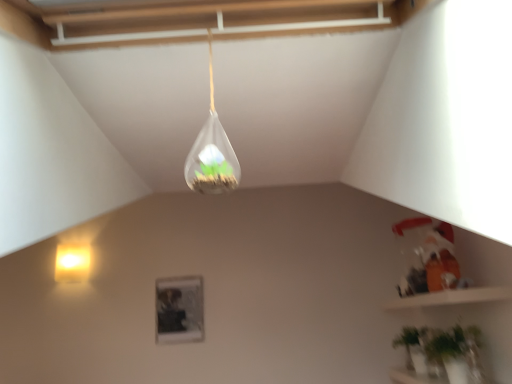
Measure the distance between transparent glass terrarium at upper center, the 2th lamp in the bottom-to-top sequence, and camera.

The depth of transparent glass terrarium at upper center, the 2th lamp in the bottom-to-top sequence, is 29.05 inches.

At what (x,y) coordinates should I click in order to perform the action: click on matte yellow wall sconce at left, acting as the 2th lamp starting from the front. Please return your answer as a coordinate pair (x, y). Image resolution: width=512 pixels, height=384 pixels. Looking at the image, I should click on coord(73,262).

Locate an element on the screen. transparent glass terrarium at upper center, the first lamp from the front is located at coordinates (212, 153).

Looking at this image, are matte yellow wall sconce at left, which is the second lamp in top-to-bottom order, and green matte plant at lower right beside each other?

They are not placed beside each other.

Could you tell me if matte yellow wall sconce at left, the 2th lamp in the right-to-left sequence, is facing green matte plant at lower right?

No, matte yellow wall sconce at left, the 2th lamp in the right-to-left sequence, is not oriented towards green matte plant at lower right.

Considering the positions of points (90, 257) and (471, 355), is point (90, 257) closer to camera compared to point (471, 355)?

No, it is not.

From a real-world perspective, who is located lower, matte yellow wall sconce at left, which is the 1th lamp in bottom-to-top order, or green matte plant at lower right?

green matte plant at lower right, from a real-world perspective.

Could you tell me if green matte plant at lower right is turned towards matte yellow wall sconce at left, which is the 1th lamp in bottom-to-top order?

Yes, green matte plant at lower right is turned towards matte yellow wall sconce at left, which is the 1th lamp in bottom-to-top order.

Are green matte plant at lower right and matte yellow wall sconce at left, acting as the 2th lamp starting from the front, far apart?

Yes, green matte plant at lower right and matte yellow wall sconce at left, acting as the 2th lamp starting from the front, are quite far apart.

How many degrees apart are the facing directions of green matte plant at lower right and matte yellow wall sconce at left, which is the 1th lamp in bottom-to-top order?

The facing directions of green matte plant at lower right and matte yellow wall sconce at left, which is the 1th lamp in bottom-to-top order, are 89.4 degrees apart.

From the image's perspective, which one is positioned lower, green matte plant at lower right or transparent glass terrarium at upper center, the first lamp from the front?

From the image's view, green matte plant at lower right is below.

Is point (437, 382) positioned in front of point (229, 181)?

No, (437, 382) is further to viewer.

Is green matte plant at lower right taller than transparent glass terrarium at upper center, the first lamp from the front?

No.

Considering the relative sizes of green matte plant at lower right and transparent glass terrarium at upper center, the 1th lamp from the right, in the image provided, is green matte plant at lower right thinner than transparent glass terrarium at upper center, the 1th lamp from the right,?

No.

In the scene shown: From the image's perspective, which one is positioned higher, transparent glass terrarium at upper center, the 2th lamp in the bottom-to-top sequence, or green matte plant at lower right?

transparent glass terrarium at upper center, the 2th lamp in the bottom-to-top sequence.

From the picture: In the image, is transparent glass terrarium at upper center, the first lamp from the front, on the left side or the right side of green matte plant at lower right?

transparent glass terrarium at upper center, the first lamp from the front, is to the left of green matte plant at lower right.

Is transparent glass terrarium at upper center, the 2th lamp when ordered from left to right, far from green matte plant at lower right?

That's right, there is a large distance between transparent glass terrarium at upper center, the 2th lamp when ordered from left to right, and green matte plant at lower right.

From the image's perspective, is matte yellow wall sconce at left, the 2th lamp in the right-to-left sequence, above or below transparent glass terrarium at upper center, the 1th lamp from the right?

From the image's perspective, matte yellow wall sconce at left, the 2th lamp in the right-to-left sequence, appears below transparent glass terrarium at upper center, the 1th lamp from the right.

Which is in front, matte yellow wall sconce at left, acting as the 2th lamp starting from the front, or transparent glass terrarium at upper center, the 1th lamp from the right?

transparent glass terrarium at upper center, the 1th lamp from the right, is closer to the camera.

Is matte yellow wall sconce at left, which ranks as the first lamp in left-to-right order, aimed at transparent glass terrarium at upper center, the first lamp from the front?

No.

Can you confirm if matte yellow wall sconce at left, the 2th lamp in the right-to-left sequence, is thinner than transparent glass terrarium at upper center, the first lamp from the front?

Incorrect, the width of matte yellow wall sconce at left, the 2th lamp in the right-to-left sequence, is not less than that of transparent glass terrarium at upper center, the first lamp from the front.

Considering the positions of objects transparent glass terrarium at upper center, which is counted as the 2th lamp, starting from the back, and matte yellow wall sconce at left, which is the 1th lamp in bottom-to-top order, in the image provided, who is more to the right, transparent glass terrarium at upper center, which is counted as the 2th lamp, starting from the back, or matte yellow wall sconce at left, which is the 1th lamp in bottom-to-top order,?

From the viewer's perspective, transparent glass terrarium at upper center, which is counted as the 2th lamp, starting from the back, appears more on the right side.

From the image's perspective, is transparent glass terrarium at upper center, which is counted as the 2th lamp, starting from the back, over matte yellow wall sconce at left, acting as the 2th lamp starting from the front?

Yes.

Consider the image. From a real-world perspective, is transparent glass terrarium at upper center, which is counted as the 2th lamp, starting from the back, above or below matte yellow wall sconce at left, the 2th lamp in the right-to-left sequence?

Clearly, from a real-world perspective, transparent glass terrarium at upper center, which is counted as the 2th lamp, starting from the back, is below matte yellow wall sconce at left, the 2th lamp in the right-to-left sequence.

Find the location of `houseplant that appears on the right of matte yellow wall sconce at left, which is the second lamp in top-to-bottom order`. houseplant that appears on the right of matte yellow wall sconce at left, which is the second lamp in top-to-bottom order is located at coordinates (442, 356).

Where is `lamp behind the green matte plant at lower right`? lamp behind the green matte plant at lower right is located at coordinates (73, 262).

Estimate the real-world distances between objects in this image. Which object is closer to matte yellow wall sconce at left, acting as the 2th lamp starting from the front, green matte plant at lower right or transparent glass terrarium at upper center, which is counted as the 2th lamp, starting from the back?

Among the two, green matte plant at lower right is located nearer to matte yellow wall sconce at left, acting as the 2th lamp starting from the front.

Looking at the image, which one is located further to transparent glass terrarium at upper center, the 1th lamp from the right, green matte plant at lower right or matte yellow wall sconce at left, which is the second lamp in top-to-bottom order?

matte yellow wall sconce at left, which is the second lamp in top-to-bottom order, is further to transparent glass terrarium at upper center, the 1th lamp from the right.

Based on their spatial positions, is transparent glass terrarium at upper center, the 2th lamp in the bottom-to-top sequence, or matte yellow wall sconce at left, the 2th lamp in the right-to-left sequence, closer to green matte plant at lower right?

transparent glass terrarium at upper center, the 2th lamp in the bottom-to-top sequence, is positioned closer to the anchor green matte plant at lower right.

When comparing their distances from matte yellow wall sconce at left, the 2th lamp in the right-to-left sequence, does transparent glass terrarium at upper center, which is the 1th lamp in top-to-bottom order, or green matte plant at lower right seem further?

transparent glass terrarium at upper center, which is the 1th lamp in top-to-bottom order, is further to matte yellow wall sconce at left, the 2th lamp in the right-to-left sequence.

Looking at the image, which one is located further to green matte plant at lower right, matte yellow wall sconce at left, which is the second lamp in top-to-bottom order, or transparent glass terrarium at upper center, the 1th lamp from the right?

The object further to green matte plant at lower right is matte yellow wall sconce at left, which is the second lamp in top-to-bottom order.

When comparing their distances from transparent glass terrarium at upper center, which is counted as the 2th lamp, starting from the back, does matte yellow wall sconce at left, acting as the 1th lamp starting from the back, or green matte plant at lower right seem further?

The object further to transparent glass terrarium at upper center, which is counted as the 2th lamp, starting from the back, is matte yellow wall sconce at left, acting as the 1th lamp starting from the back.

I want to click on houseplant between transparent glass terrarium at upper center, the 1th lamp from the right, and matte yellow wall sconce at left, acting as the 1th lamp starting from the back, along the z-axis, so click(442, 356).